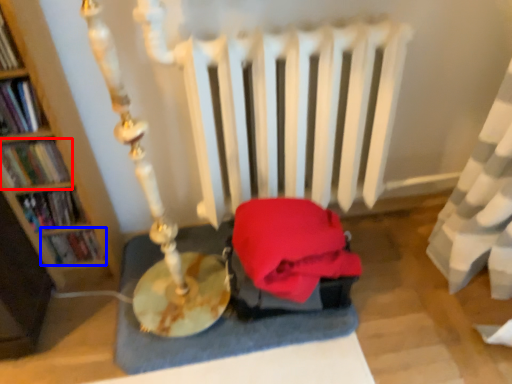
Question: Which of the following is the closest to the observer, book (highlighted by a red box) or book (highlighted by a blue box)?

Choices:
 (A) book
 (B) book

Answer: (A)